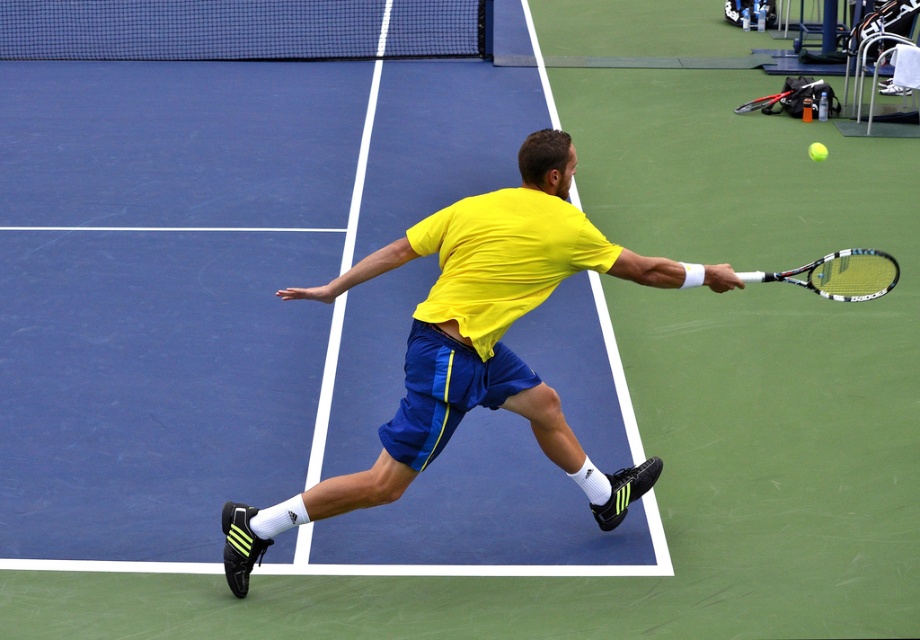
Does white matte tennis racket at center appear under green rubber tennis ball at upper right?

Correct, white matte tennis racket at center is located below green rubber tennis ball at upper right.

Does point (861, 280) come closer to viewer compared to point (811, 141)?

Yes, it is in front of point (811, 141).

Locate an element on the screen. Image resolution: width=920 pixels, height=640 pixels. white matte tennis racket at center is located at coordinates (838, 275).

Is yellow matte shirt at center further to the viewer compared to white matte tennis racket at center?

That is True.

The height and width of the screenshot is (640, 920). What do you see at coordinates (476, 344) in the screenshot?
I see `yellow matte shirt at center` at bounding box center [476, 344].

From the picture: Who is more distant from viewer, (509, 273) or (748, 280)?

The point (748, 280) is behind.

You are a GUI agent. You are given a task and a screenshot of the screen. Output one action in this format:
    pyautogui.click(x=<x>, y=<y>)
    Task: Click on the yellow matte shirt at center
    
    Given the screenshot: What is the action you would take?
    pyautogui.click(x=476, y=344)

Does yellow matte shirt at center have a larger size compared to green rubber tennis ball at upper right?

Yes, yellow matte shirt at center is bigger than green rubber tennis ball at upper right.

Locate an element on the screen. This screenshot has height=640, width=920. yellow matte shirt at center is located at coordinates (476, 344).

Where is `yellow matte shirt at center`? yellow matte shirt at center is located at coordinates (476, 344).